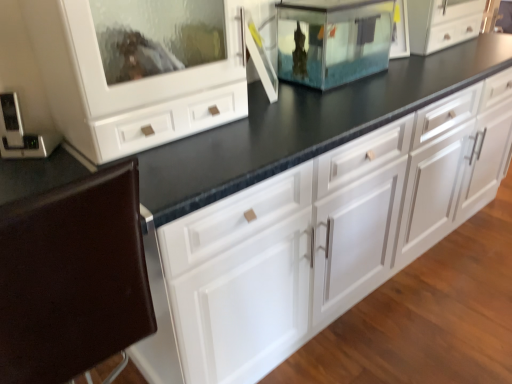
Question: From the image's perspective, relative to metallic silver thermostat at left, the first appliance when ordered from left to right, is transparent glass fish tank at center, the 2th appliance when ordered from left to right, above or below?

Choices:
 (A) below
 (B) above

Answer: (B)

Question: From a real-world perspective, relative to metallic silver thermostat at left, the second appliance viewed from the top, is transparent glass fish tank at center, which ranks as the second appliance in bottom-to-top order, vertically above or below?

Choices:
 (A) below
 (B) above

Answer: (B)

Question: Which object is positioned farthest from the transparent glass fish tank at center, acting as the 2th appliance starting from the front?

Choices:
 (A) white glossy cabinet at center
 (B) brown leather chair at lower left
 (C) metallic silver thermostat at left, the 1th appliance in the front-to-back sequence

Answer: (B)

Question: Considering the real-world distances, which object is closest to the metallic silver thermostat at left, the second appliance in the back-to-front sequence?

Choices:
 (A) white glossy cabinet at center
 (B) transparent glass fish tank at center, the 1th appliance viewed from the back
 (C) brown leather chair at lower left

Answer: (C)